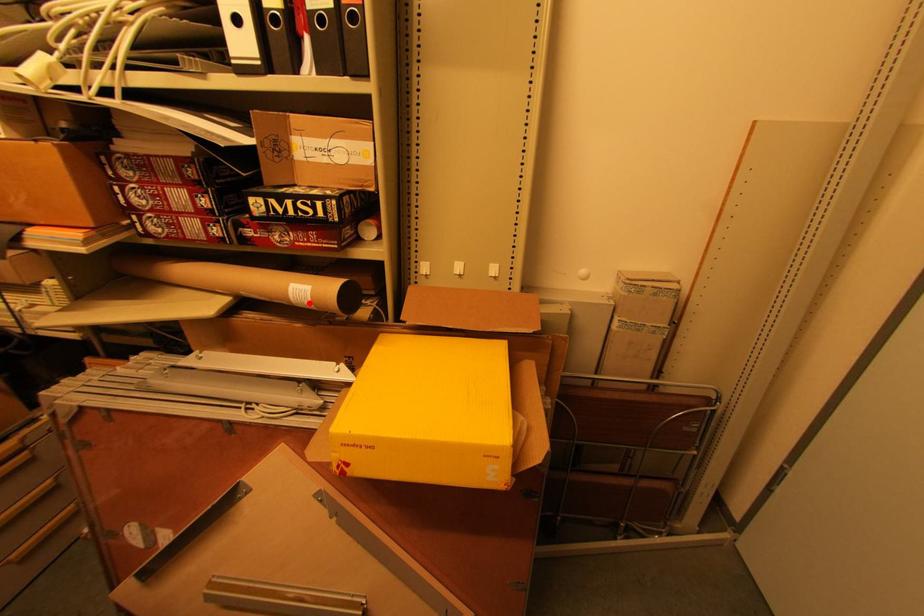
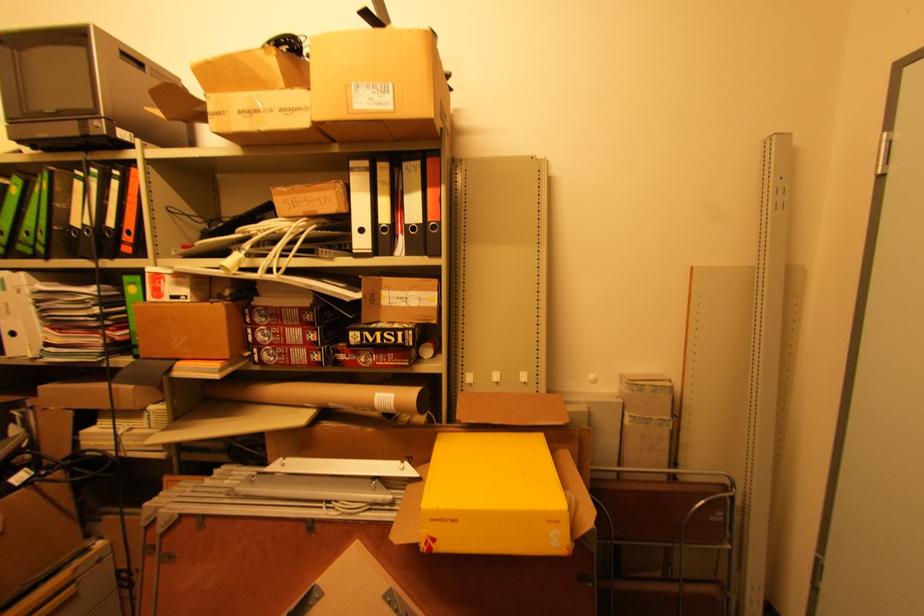
Where in the second image is the point corresponding to the highlighted location from the first image?

(392, 408)